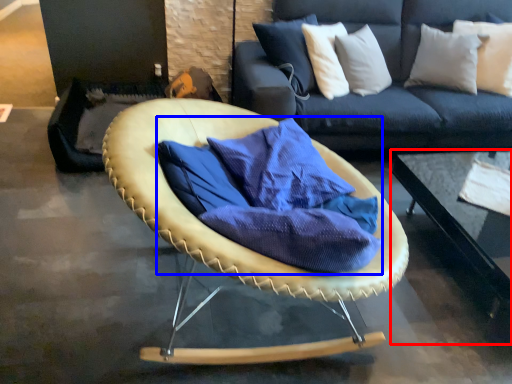
Question: Among these objects, which one is nearest to the camera, table (highlighted by a red box) or fabric (highlighted by a blue box)?

Choices:
 (A) table
 (B) fabric

Answer: (B)